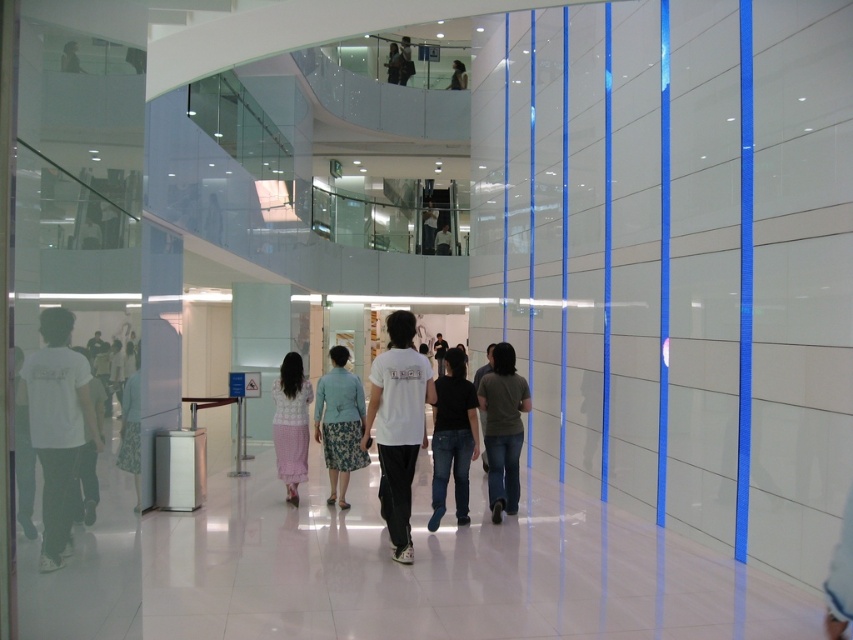
Question: Which point is closer to the camera?

Choices:
 (A) (463, 77)
 (B) (518, 413)
 (C) (444, 420)
 (D) (67, 344)

Answer: (D)

Question: Which of these objects is positioned closest to the smooth black shirt at center?

Choices:
 (A) dark gray t-shirt at center
 (B) matte black shirt at upper center
 (C) black denim jeans at center

Answer: (B)

Question: Can you confirm if white cotton t-shirt at center is positioned to the right of black denim jeans at center?

Choices:
 (A) no
 (B) yes

Answer: (A)

Question: Which object is the farthest from the black denim jeans at center?

Choices:
 (A) matte black shirt at upper center
 (B) blue textured skirt at center
 (C) white cotton t-shirt at center
 (D) smooth black shirt at center

Answer: (D)

Question: Does white matte shirt at left have a smaller size compared to black denim jeans at center?

Choices:
 (A) yes
 (B) no

Answer: (A)

Question: Is white matte shirt at left closer to camera compared to matte black jacket at upper center?

Choices:
 (A) yes
 (B) no

Answer: (A)